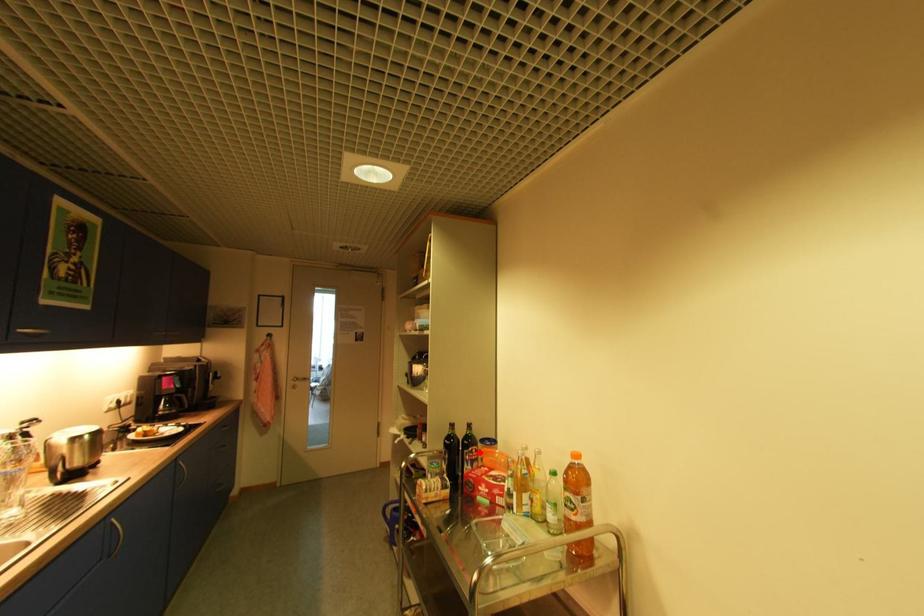
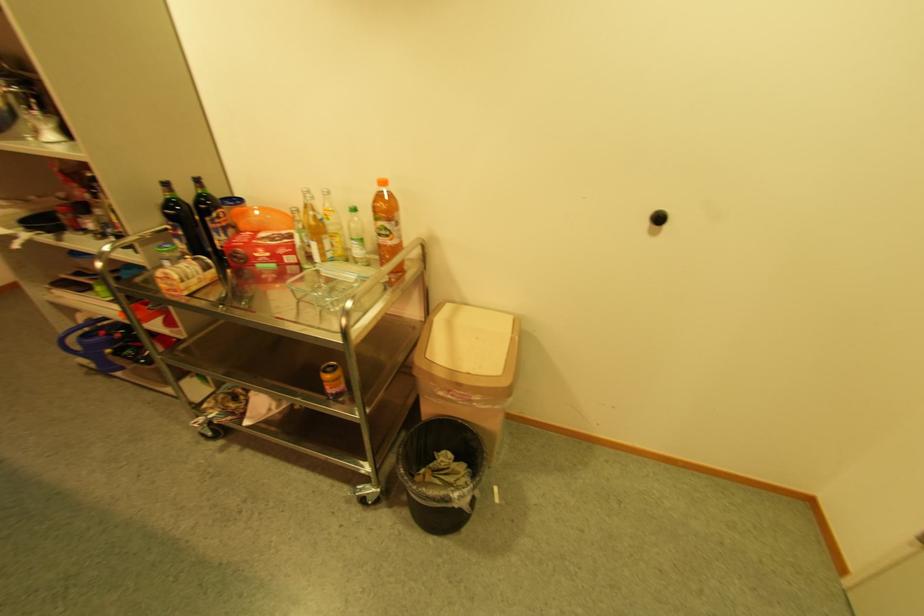
Question: A red point is marked in image1. In image2, is the corresponding 3D point closer to the camera or farther? Reply with the corresponding letter.

Choices:
 (A) The corresponding 3D point is closer.
 (B) The corresponding 3D point is farther.

Answer: (A)